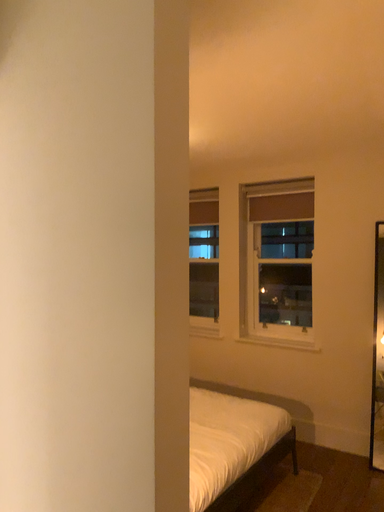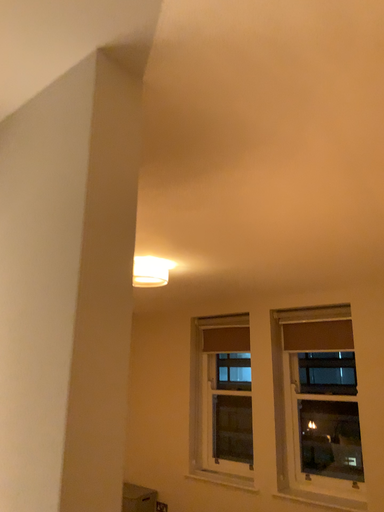
Question: Which way did the camera rotate in the video?

Choices:
 (A) rotated left
 (B) rotated right

Answer: (A)